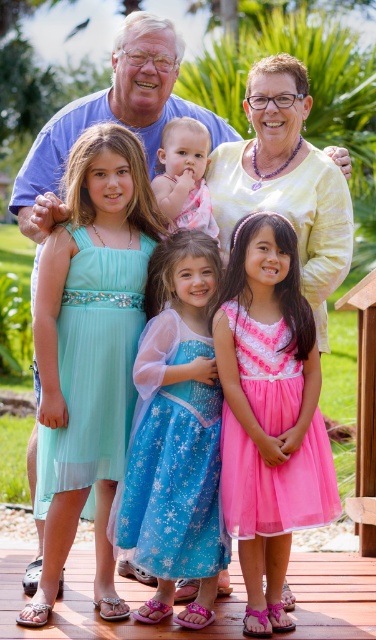
Is point (286, 464) closer to viewer compared to point (154, 193)?

That is True.

Does pink tulle dress at lower center appear on the left side of pink satin dress at center?

In fact, pink tulle dress at lower center is to the right of pink satin dress at center.

Which is in front, point (239, 440) or point (174, 218)?

Point (239, 440) is in front.

I want to click on pink tulle dress at lower center, so click(x=275, y=483).

Is blue satin dress at center behind pink tulle dress at lower center?

Yes, blue satin dress at center is further from the viewer.

Consider the image. Between blue satin dress at center and pink tulle dress at lower center, which one appears on the left side from the viewer's perspective?

blue satin dress at center

At what (x,y) coordinates should I click in order to perform the action: click on blue satin dress at center. Please return your answer as a coordinate pair (x, y). This screenshot has width=376, height=640. Looking at the image, I should click on (172, 461).

Between point (168, 502) and point (174, 156), which one is positioned behind?

The point (174, 156) is more distant.

Is blue satin dress at center closer to camera compared to pink satin dress at center?

That is True.

What do you see at coordinates (172, 461) in the screenshot? This screenshot has height=640, width=376. I see `blue satin dress at center` at bounding box center [172, 461].

At what (x,y) coordinates should I click in order to perform the action: click on blue satin dress at center. Please return your answer as a coordinate pair (x, y). This screenshot has height=640, width=376. Looking at the image, I should click on (172, 461).